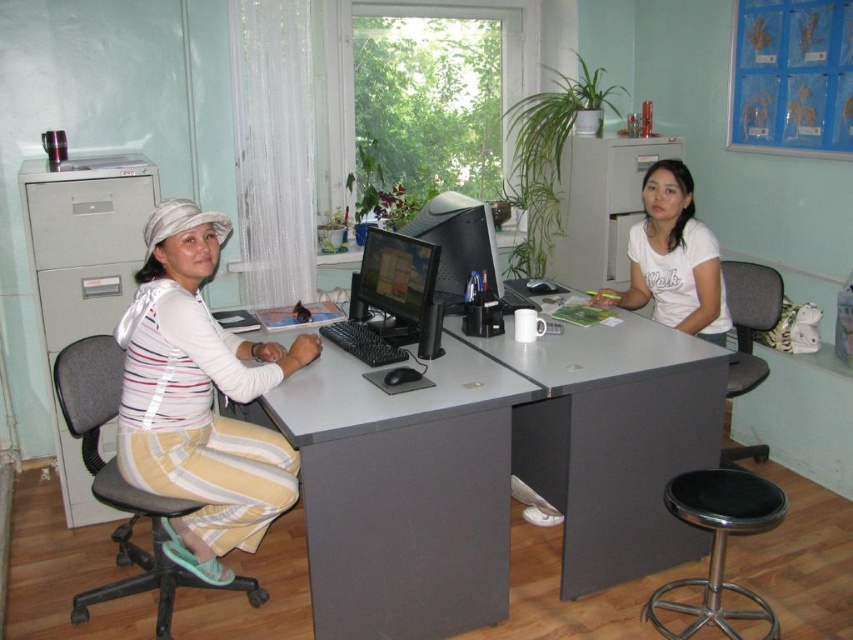
You are standing at the desk in the office scene. There are two points marked on the desk. The first is at coordinates point (227, 460) and the second at point (155, 568). Which point is closer to you as you face the desk?

Point (227, 460) is in front of point (155, 568), so it is closer to you as you face the desk.

You are a delivery person who needs to place a small package on the desk without blocking the stool. Given the current arrangement of the gray matte computer desk at center and the black leather stool at lower right, where should you place the package?

The gray matte computer desk at center is positioned on the left side of the black leather stool at lower right. To place the package without blocking the stool, you should put it on the right side of the gray matte computer desk at center, away from the stool.